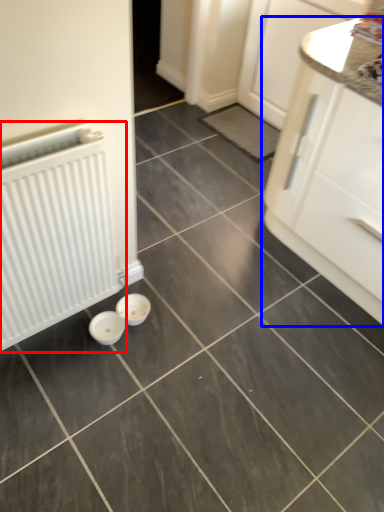
Question: Among these objects, which one is nearest to the camera, radiator (highlighted by a red box) or cabinetry (highlighted by a blue box)?

Choices:
 (A) radiator
 (B) cabinetry

Answer: (A)